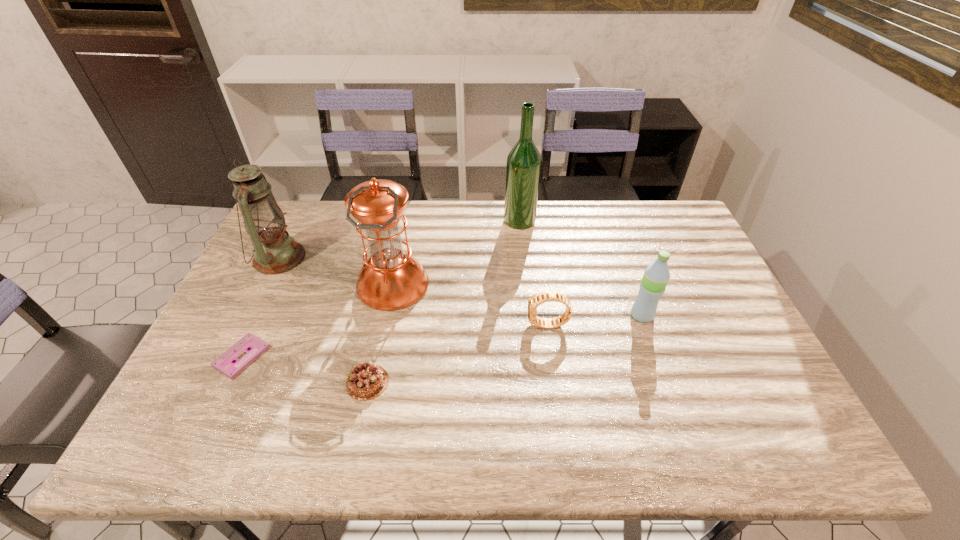
Find the location of a particular element. vacant region located on the right of the left oil lamp is located at coordinates (329, 258).

Where is `free spot located 0.270m on the front of the rightmost object`? The height and width of the screenshot is (540, 960). free spot located 0.270m on the front of the rightmost object is located at coordinates (676, 414).

Image resolution: width=960 pixels, height=540 pixels. Find the location of `vacant region located on the face of the fifth tallest object`. vacant region located on the face of the fifth tallest object is located at coordinates (498, 325).

Locate an element on the screen. The image size is (960, 540). vacant space located on the face of the fifth tallest object is located at coordinates (506, 325).

Find the location of a particular element. free spot located on the face of the fifth tallest object is located at coordinates (509, 325).

You are a GUI agent. You are given a task and a screenshot of the screen. Output one action in this format:
    pyautogui.click(x=<x>, y=<y>)
    Task: Click on the free space located on the right of the sixth tallest object
    
    Given the screenshot: What is the action you would take?
    pyautogui.click(x=418, y=382)

Identify the location of vacant point located 0.260m on the right of the videotape. (368, 357).

At what (x,y) coordinates should I click in order to perform the action: click on alcohol located in the far edge section of the desktop. Please return your answer as a coordinate pair (x, y). The image size is (960, 540). Looking at the image, I should click on (523, 167).

Image resolution: width=960 pixels, height=540 pixels. In order to click on oil lamp that is at the far edge in this screenshot , I will do `click(274, 252)`.

Locate an element on the screen. oil lamp that is at the left edge is located at coordinates (274, 252).